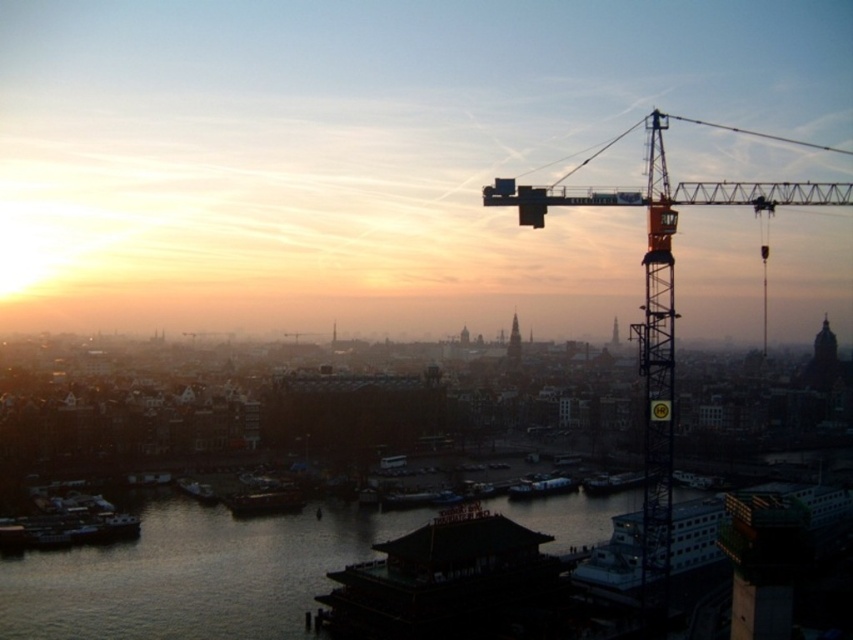
You are a photographer trying to capture the reflection of the orange metallic crane at upper right in the dark water at lower center. Based on the scene, will the crane be fully visible in the water reflection?

The dark water at lower center has a lesser height compared to orange metallic crane at upper right, so the crane may not be fully visible in the water reflection since the water is lower in height than the crane.

You are standing in the city park and see the dark water at lower center and the orange metallic crane at upper right. Which object is nearer to you?

The dark water at lower center is closer to the viewer than the orange metallic crane at upper right.